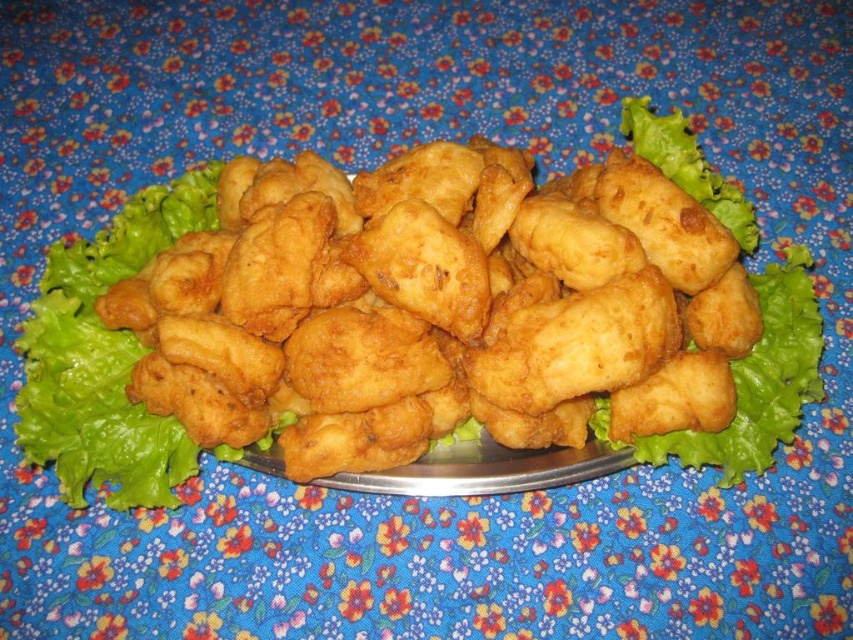
Question: Does golden fried nugget at center have a larger size compared to green leafy lettuce at center?

Choices:
 (A) yes
 (B) no

Answer: (A)

Question: Which point appears closest to the camera in this image?

Choices:
 (A) (61, 484)
 (B) (683, 204)

Answer: (B)

Question: Where is golden fried nugget at center located in relation to green leafy lettuce at center in the image?

Choices:
 (A) below
 (B) above

Answer: (A)

Question: Can you confirm if golden fried nugget at center is positioned above green leafy lettuce at center?

Choices:
 (A) no
 (B) yes

Answer: (A)